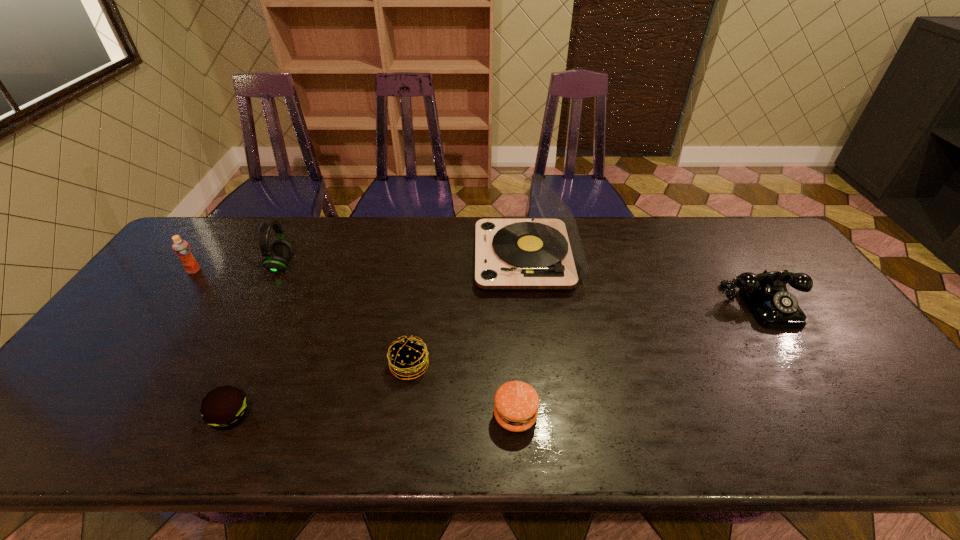
Identify the location of free space between the sixth shortest object and the rightmost patty. (398, 340).

Find the location of a particular element. The width and height of the screenshot is (960, 540). vacant area between the rightmost patty and the record player is located at coordinates (521, 337).

You are a GUI agent. You are given a task and a screenshot of the screen. Output one action in this format:
    pyautogui.click(x=<x>, y=<y>)
    Task: Click on the vacant space that is in between the second patty from left to right and the leftmost patty
    The image size is (960, 540).
    Given the screenshot: What is the action you would take?
    pyautogui.click(x=320, y=391)

The width and height of the screenshot is (960, 540). Identify the location of free space that is in between the record player and the sixth shortest object. (404, 262).

This screenshot has height=540, width=960. I want to click on unoccupied position between the rightmost patty and the fifth shortest object, so click(354, 343).

Identify the location of unoccupied area between the leftmost patty and the tallest object. (379, 337).

Where is `vacant area between the record player and the headset`? vacant area between the record player and the headset is located at coordinates (404, 262).

Find the location of a particular element. vacant area between the rightmost patty and the tallest object is located at coordinates (521, 337).

You are a GUI agent. You are given a task and a screenshot of the screen. Output one action in this format:
    pyautogui.click(x=<x>, y=<y>)
    Task: Click on the vacant space in between the fourth shortest object and the leftmost patty
    This screenshot has width=960, height=540.
    Given the screenshot: What is the action you would take?
    pyautogui.click(x=498, y=360)

Locate an element on the screen. the third closest object to the fifth farthest object is located at coordinates (224, 407).